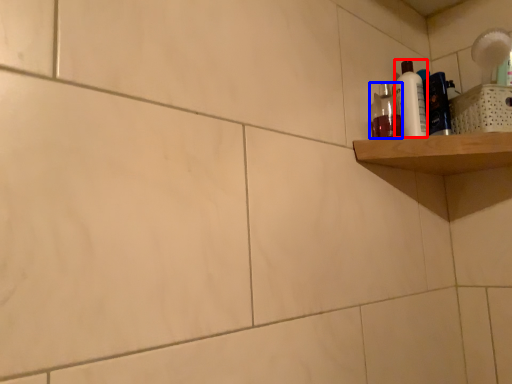
Question: Which object appears closest to the camera in this image, cleaning product (highlighted by a red box) or mouthwash (highlighted by a blue box)?

Choices:
 (A) cleaning product
 (B) mouthwash

Answer: (B)